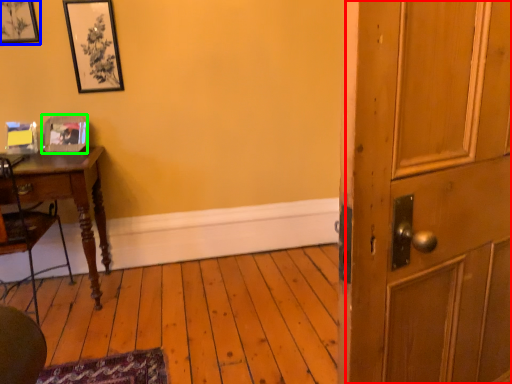
Question: Based on their relative distances, which object is nearer to barn door (highlighted by a red box)? Choose from picture frame (highlighted by a blue box) and picture frame (highlighted by a green box).

Choices:
 (A) picture frame
 (B) picture frame

Answer: (B)